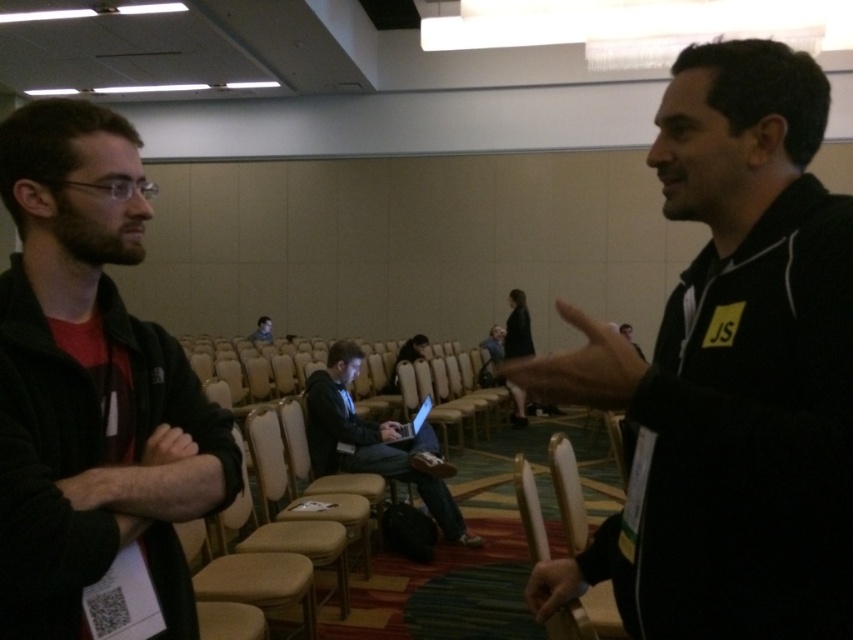
You are organizing a presentation and need to place a name tag on the silver metallic laptop at center so it can be seen from across the room. Considering the height of the light brown leather chair at center, will the laptop be visible over the chair when placed there?

The silver metallic laptop at center has a lesser height compared to light brown leather chair at center, so the laptop will not be visible over the chair when placed there.

You are standing in the conference room and want to hand a document to the person wearing the black matte jacket at right. The document is 12 inches long. Can you reach them without moving closer?

The black matte jacket at right and viewer are 31.75 inches apart from each other. Since the document is 12 inches long, you can extend your arm to reach them as 31.75 inches is within a typical arm reach distance.

You are sitting in the light brown leather chair at center and want to use the silver metallic laptop at center. Can you easily reach it without moving from your seat?

The silver metallic laptop at center is below the light brown leather chair at center, so you can easily reach it while sitting in the chair.